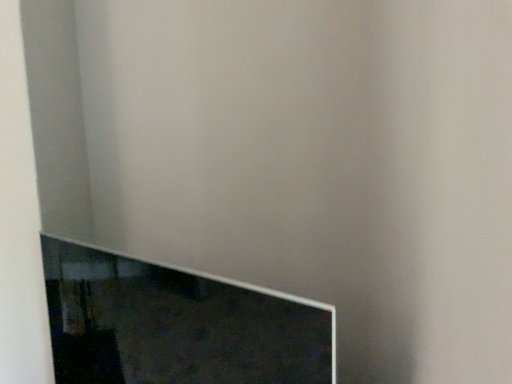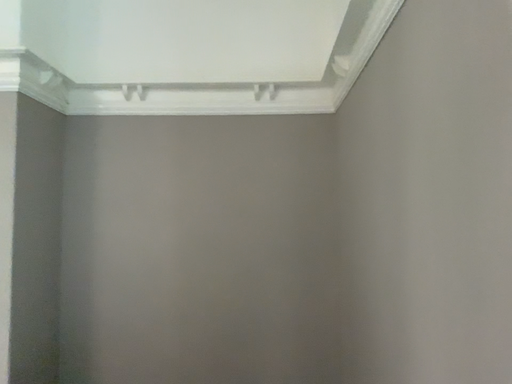
Question: Which way did the camera rotate in the video?

Choices:
 (A) rotated upward
 (B) rotated downward

Answer: (A)